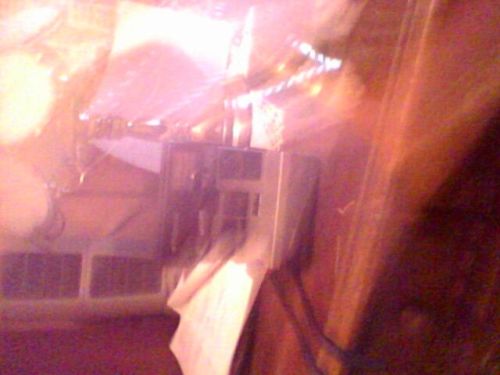
Locate an element on the screen. vents is located at coordinates (122, 285), (39, 270).